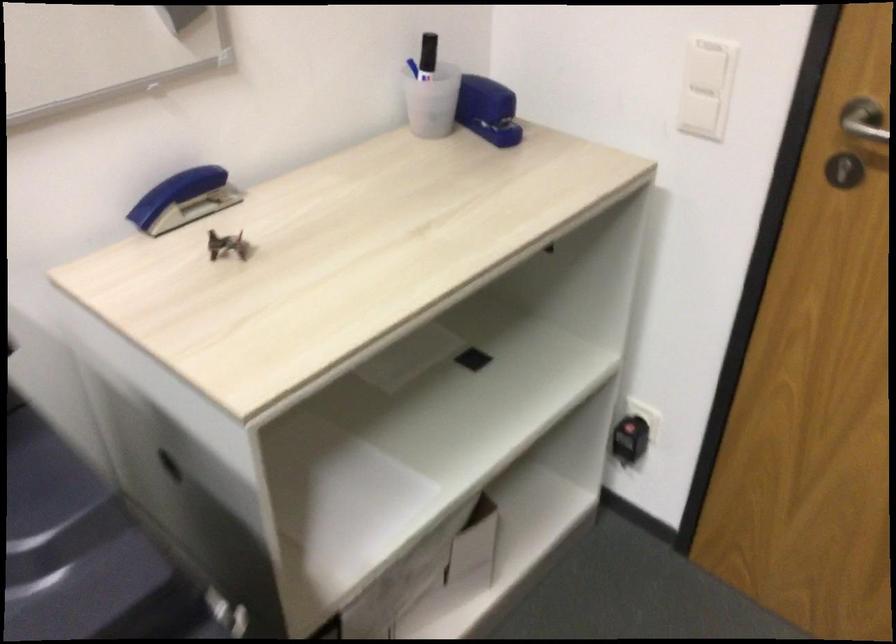
Image resolution: width=896 pixels, height=644 pixels. I want to click on silver door handle, so click(864, 120).